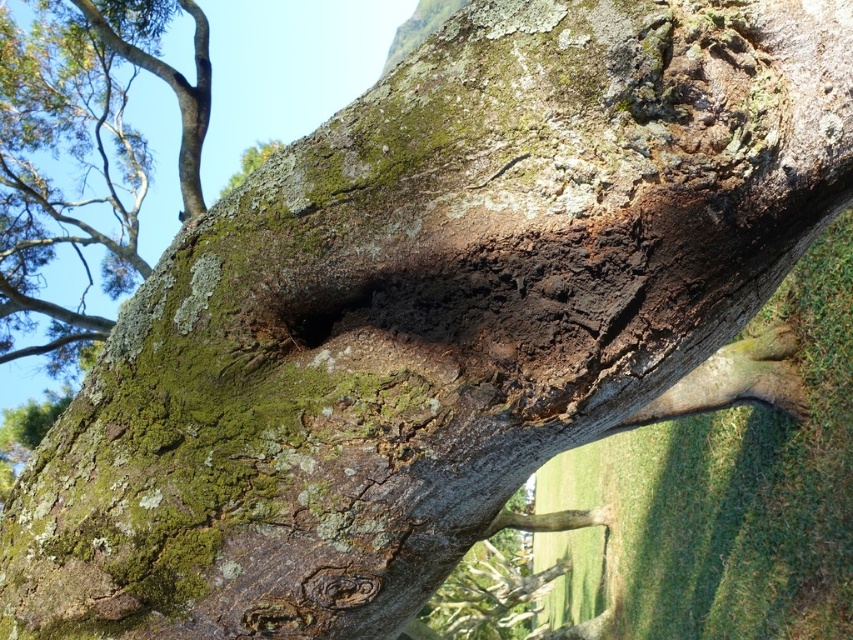
Can you confirm if green mossy bark at upper left is positioned below dark brown rough hole at center?

No.

Which is behind, point (125, 179) or point (312, 310)?

The point (125, 179) is behind.

Where is `green mossy bark at upper left`? green mossy bark at upper left is located at coordinates (84, 145).

You are a GUI agent. You are given a task and a screenshot of the screen. Output one action in this format:
    pyautogui.click(x=<x>, y=<y>)
    Task: Click on the green mossy bark at upper left
    
    Given the screenshot: What is the action you would take?
    pyautogui.click(x=84, y=145)